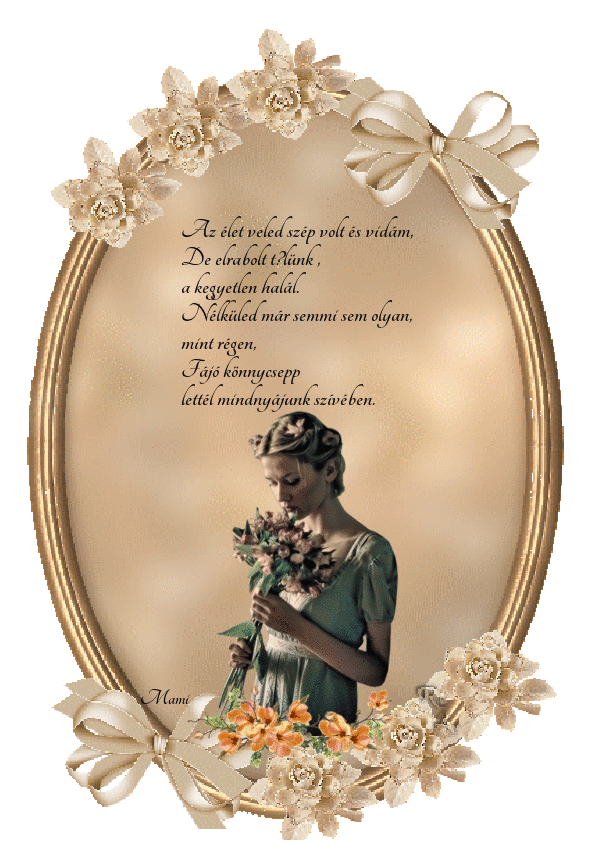
Identify the location of orange flowers. (284, 745), (259, 710), (246, 728), (330, 724).